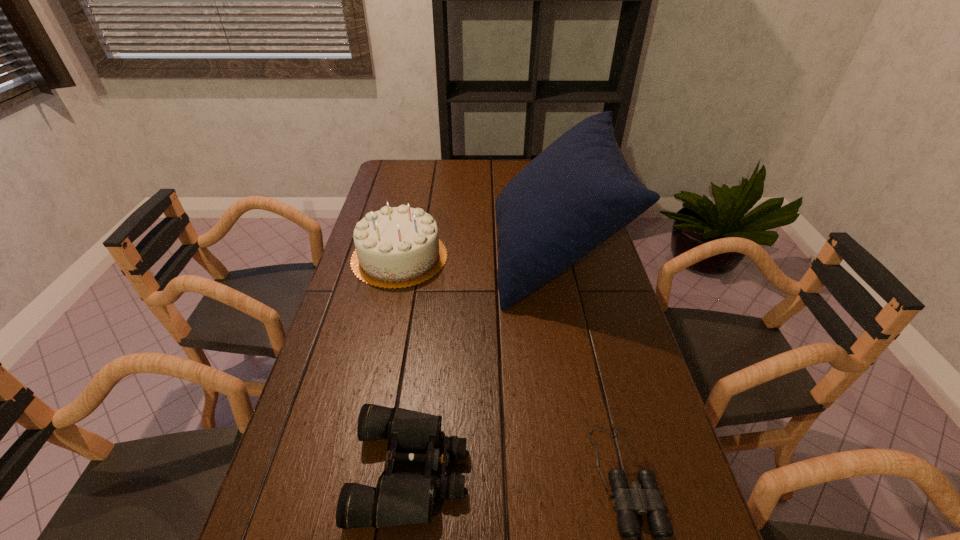
At what (x,y) coordinates should I click in order to perform the action: click on binoculars that is positioned at the left edge. Please return your answer as a coordinate pair (x, y). The height and width of the screenshot is (540, 960). Looking at the image, I should click on (400, 498).

Where is `object at the right edge`? The height and width of the screenshot is (540, 960). object at the right edge is located at coordinates (578, 192).

Identify the location of vacant region at the far edge of the desktop. The width and height of the screenshot is (960, 540). (468, 163).

In the image, there is a desktop. Identify the location of blank space at the left edge. Image resolution: width=960 pixels, height=540 pixels. (303, 517).

In the image, there is a desktop. Where is `vacant space at the right edge`? This screenshot has width=960, height=540. vacant space at the right edge is located at coordinates (583, 320).

In the image, there is a desktop. Where is `vacant space at the far left corner`? vacant space at the far left corner is located at coordinates (418, 164).

Find the location of a particular element. The height and width of the screenshot is (540, 960). vacant space in between the third tallest object and the second tallest object is located at coordinates (405, 363).

Identify the location of free space between the tallest object and the second shortest object. Image resolution: width=960 pixels, height=540 pixels. (481, 363).

Find the location of a particular element. free spot between the taller binoculars and the tallest object is located at coordinates (481, 363).

I want to click on vacant point located between the second shortest object and the tallest object, so click(481, 363).